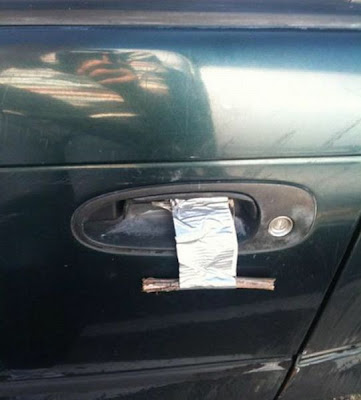
What are the coordinates of `key hole` in the screenshot? It's located at (284, 225).